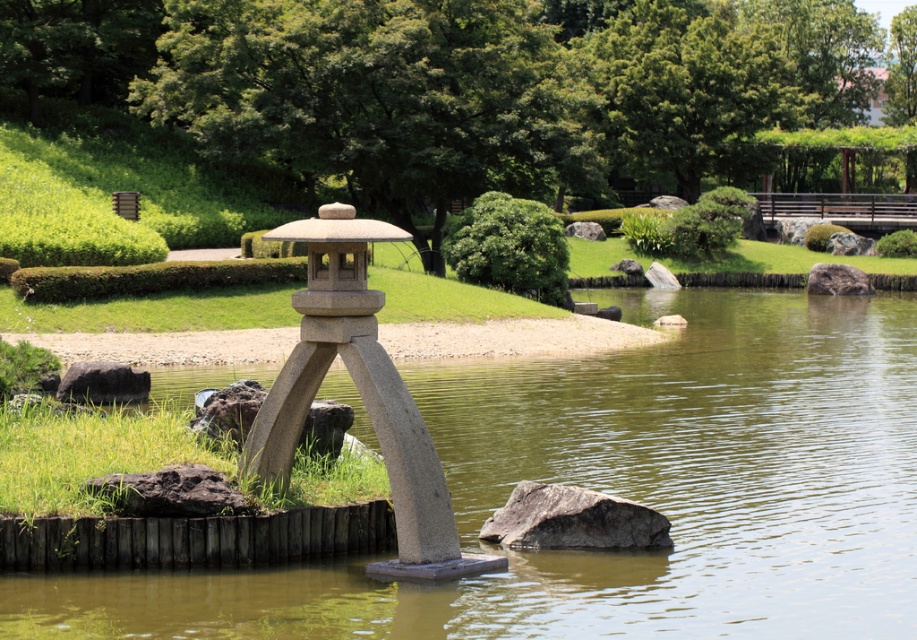
Is clear water at center positioned in front of gray smooth rock at right?

That is True.

Does clear water at center appear on the left side of gray smooth rock at right?

Correct, you'll find clear water at center to the left of gray smooth rock at right.

Does point (683, 384) lie behind point (818, 291)?

No.

Identify the location of clear water at center. This screenshot has height=640, width=917. (617, 492).

From the picture: Does gray rough rock at lower center have a smaller size compared to gray smooth rock at right?

Yes, gray rough rock at lower center is smaller than gray smooth rock at right.

Which is behind, point (556, 524) or point (822, 269)?

Point (822, 269)

This screenshot has height=640, width=917. I want to click on gray rough rock at lower center, so click(573, 518).

Can you confirm if smooth stone lantern at center is positioned below dark gray rock at lower left?

No.

Based on the photo, who is positioned more to the right, smooth stone lantern at center or dark gray rock at lower left?

Positioned to the right is smooth stone lantern at center.

Is point (396, 534) behind point (56, 392)?

That is False.

Where is `smooth stone lantern at center`? smooth stone lantern at center is located at coordinates (360, 394).